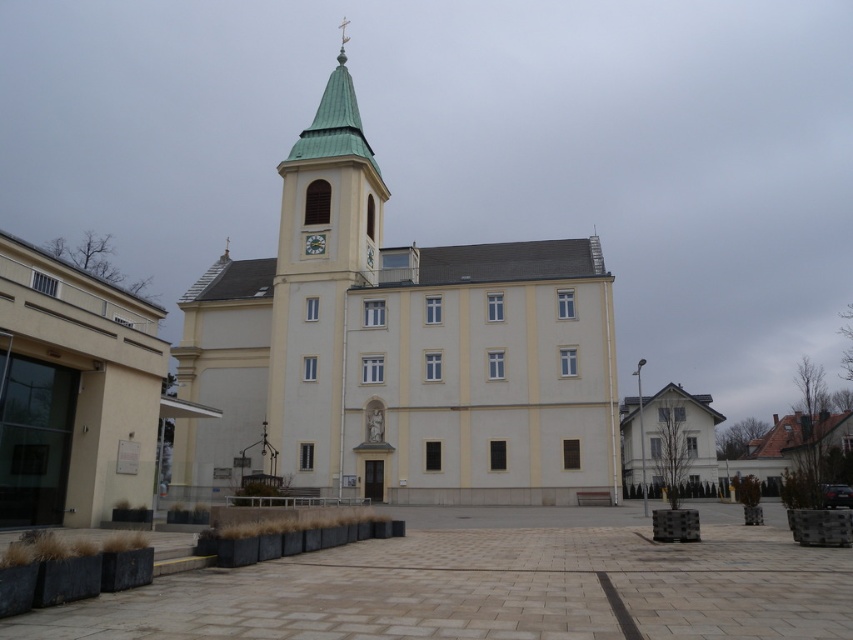
You are standing in front of a large building and notice the beige stucco church at center. Based on its architectural features, can you determine its primary purpose?

The beige stucco church at center has a cross on the tower and a clock face, which are common features of religious buildings like churches, indicating its primary purpose is likely for religious worship and community gatherings.

You are standing in front of a church with a tower. There is a point marked at coordinates (397,349). Based on the scene description, where is this point located?

The point is located on the beige stucco church at center.